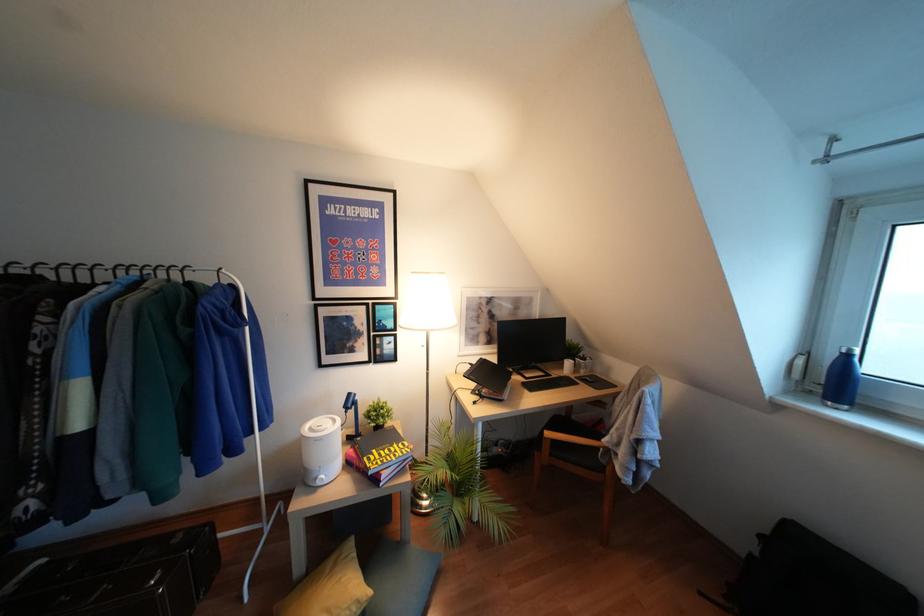
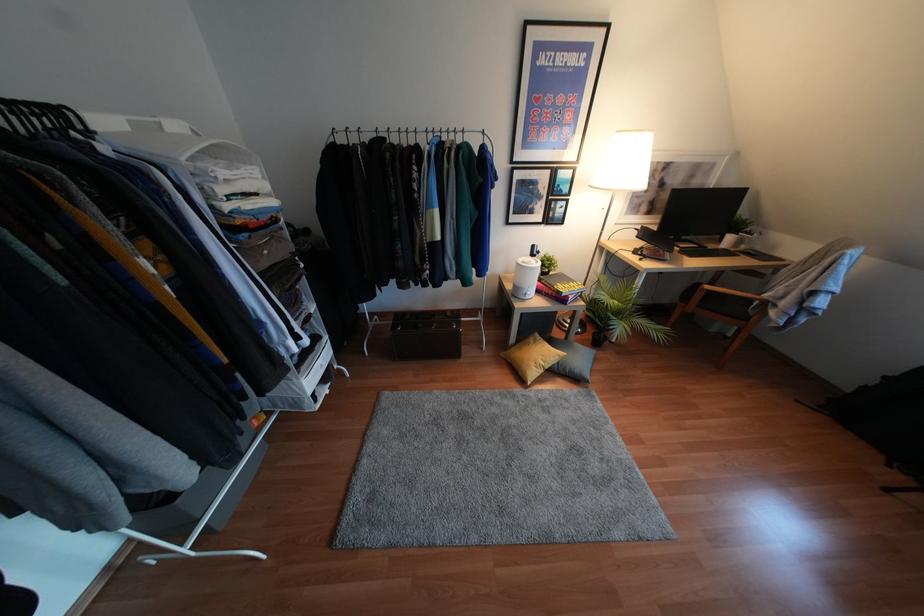
The point at (546, 434) is marked in the first image. Where is the corresponding point in the second image?

(707, 286)